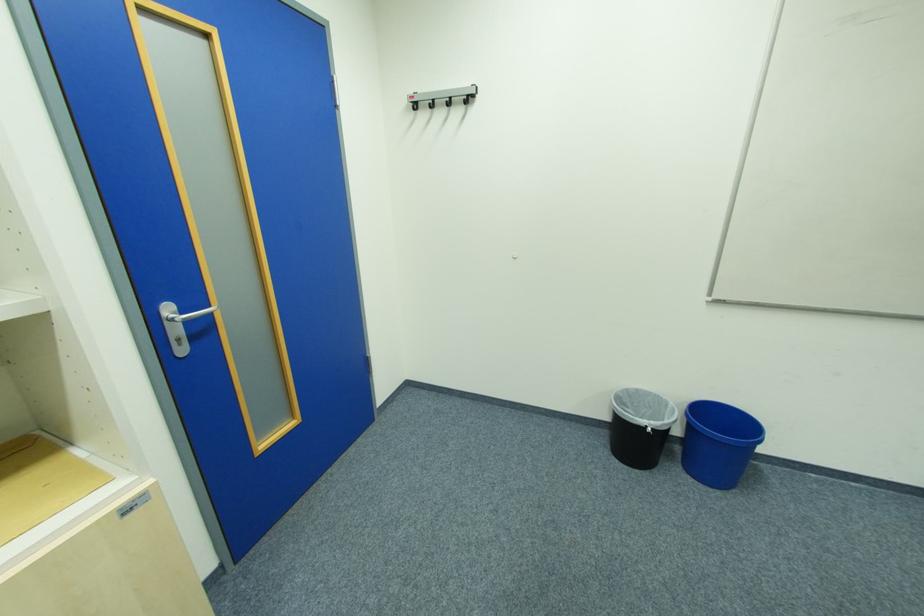
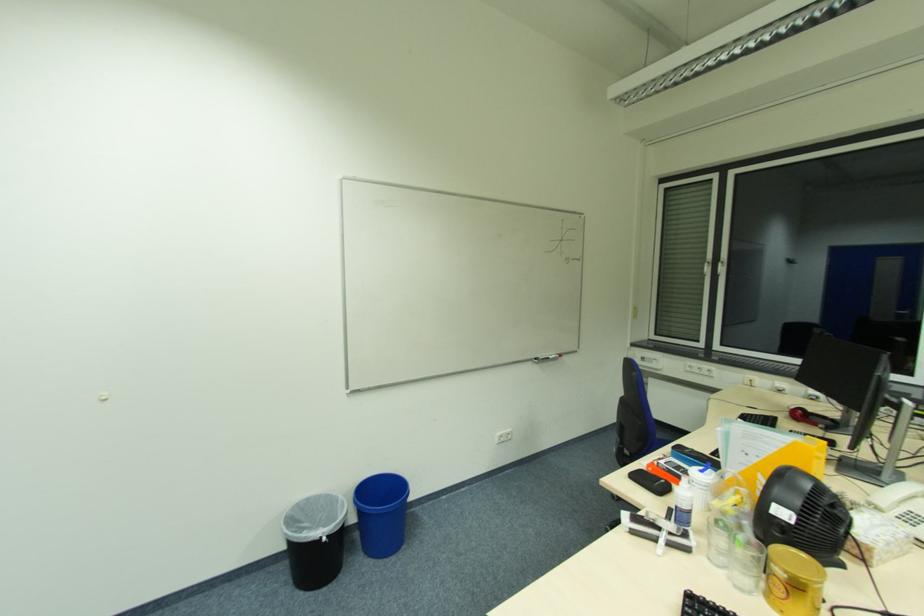
Question: The first image is from the beginning of the video and the second image is from the end. How did the camera likely rotate when shooting the video?

Choices:
 (A) Left
 (B) Right
 (C) Up
 (D) Down

Answer: (B)